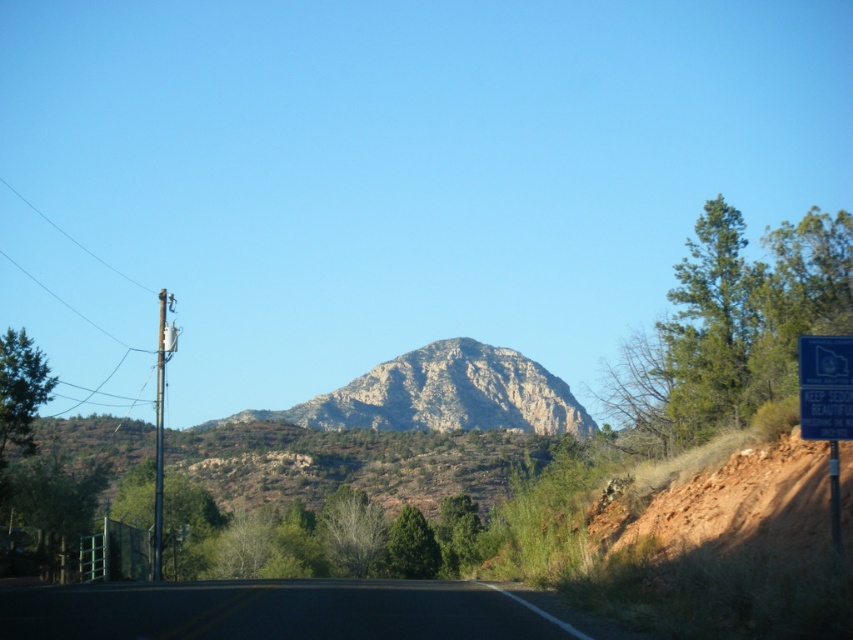
Question: Which point is closer to the camera taking this photo?

Choices:
 (A) (390, 426)
 (B) (53, 605)
 (C) (836, 358)

Answer: (C)

Question: Can you confirm if rugged stone mountain at center is smaller than blue plastic sign at right?

Choices:
 (A) yes
 (B) no

Answer: (B)

Question: Which object is closer to the camera taking this photo?

Choices:
 (A) blue plastic sign at right
 (B) rugged stone mountain at center

Answer: (A)

Question: Which point is closer to the camera taking this photo?

Choices:
 (A) (120, 604)
 (B) (473, 369)
 (C) (836, 378)

Answer: (C)

Question: Can you confirm if black asphalt road at center is thinner than blue plastic sign at right?

Choices:
 (A) yes
 (B) no

Answer: (B)

Question: Is black asphalt road at center thinner than rugged stone mountain at center?

Choices:
 (A) no
 (B) yes

Answer: (B)